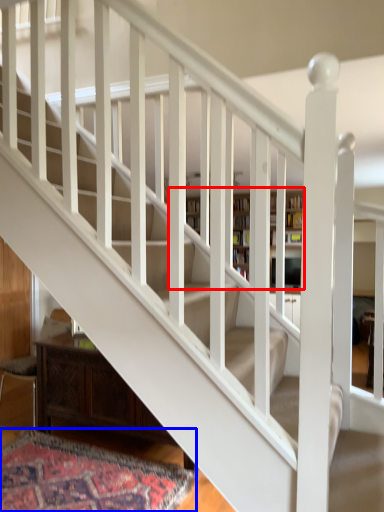
Question: Which of the following is the farthest to the observer, bookcase (highlighted by a red box) or mat (highlighted by a blue box)?

Choices:
 (A) bookcase
 (B) mat

Answer: (A)